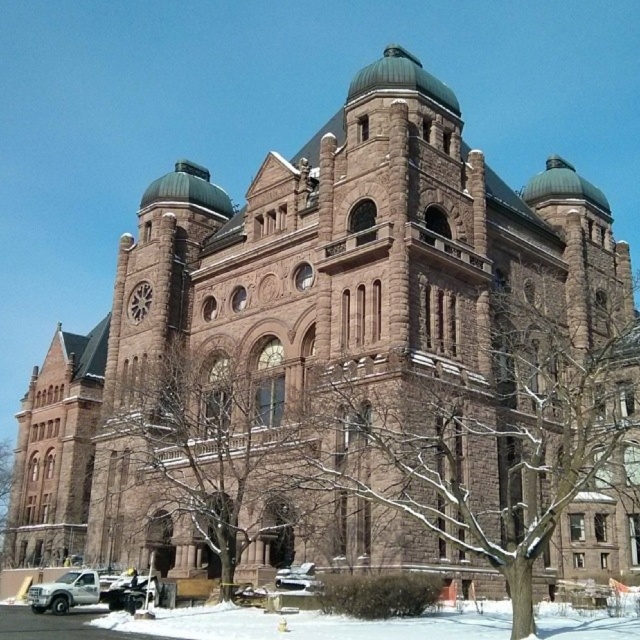
Question: From the image, what is the correct spatial relationship of white powdery snow at lower center in relation to silver metallic truck at lower left?

Choices:
 (A) below
 (B) above

Answer: (B)

Question: Where is white powdery snow at lower center located in relation to silver metallic truck at lower left in the image?

Choices:
 (A) above
 (B) below

Answer: (A)

Question: Which point is closer to the camera taking this photo?

Choices:
 (A) (77, 589)
 (B) (573, 627)
 (C) (305, 570)

Answer: (B)

Question: Which of these objects is positioned closest to the white powdery snow at lower center?

Choices:
 (A) silver metallic car at lower center
 (B) silver metallic truck at lower left

Answer: (A)

Question: Among these objects, which one is farthest from the camera?

Choices:
 (A) white powdery snow at lower center
 (B) silver metallic truck at lower left

Answer: (B)

Question: Does white powdery snow at lower center have a lesser width compared to silver metallic car at lower center?

Choices:
 (A) no
 (B) yes

Answer: (A)